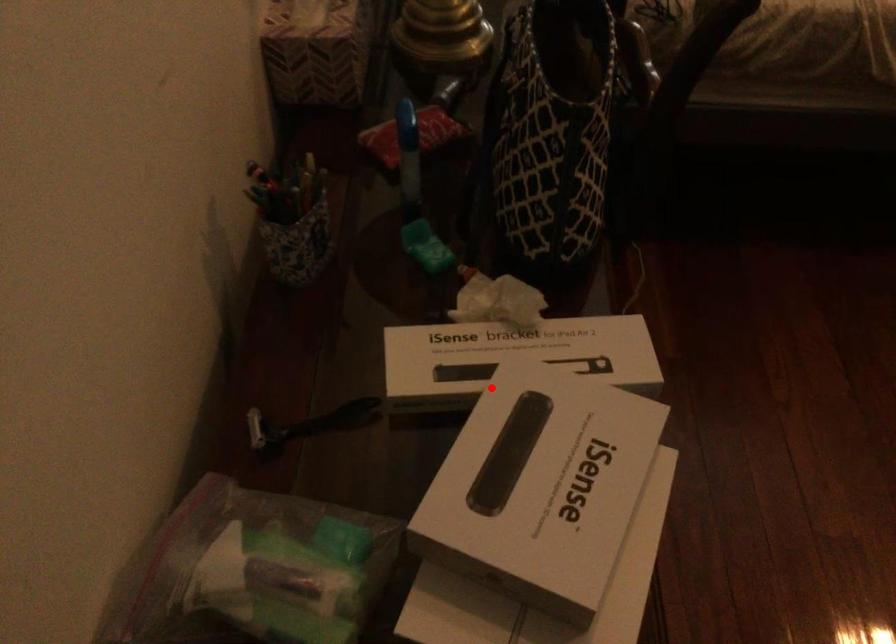
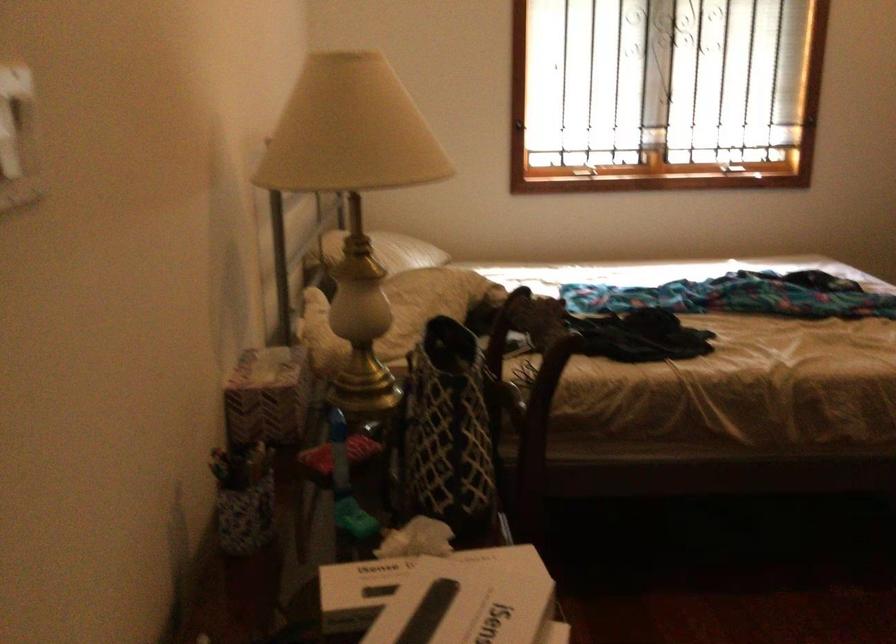
Question: I am providing you with two images of the same scene from different viewpoints. In image1, a red point is highlighted. Considering the same 3D point in image2, which of the following is correct?

Choices:
 (A) It is closer
 (B) It is farther

Answer: (B)